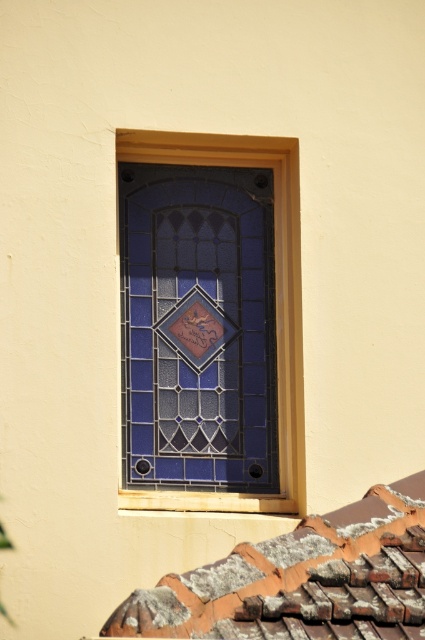
Question: Can you confirm if rusty clay tiles at lower right is bigger than blue stained glass at center?

Choices:
 (A) yes
 (B) no

Answer: (A)

Question: Does rusty clay tiles at lower right have a smaller size compared to blue stained glass at center?

Choices:
 (A) yes
 (B) no

Answer: (B)

Question: Does rusty clay tiles at lower right have a smaller size compared to blue stained glass at center?

Choices:
 (A) yes
 (B) no

Answer: (B)

Question: Which of the following is the closest to the observer?

Choices:
 (A) rusty clay tiles at lower right
 (B) blue stained glass at center

Answer: (A)